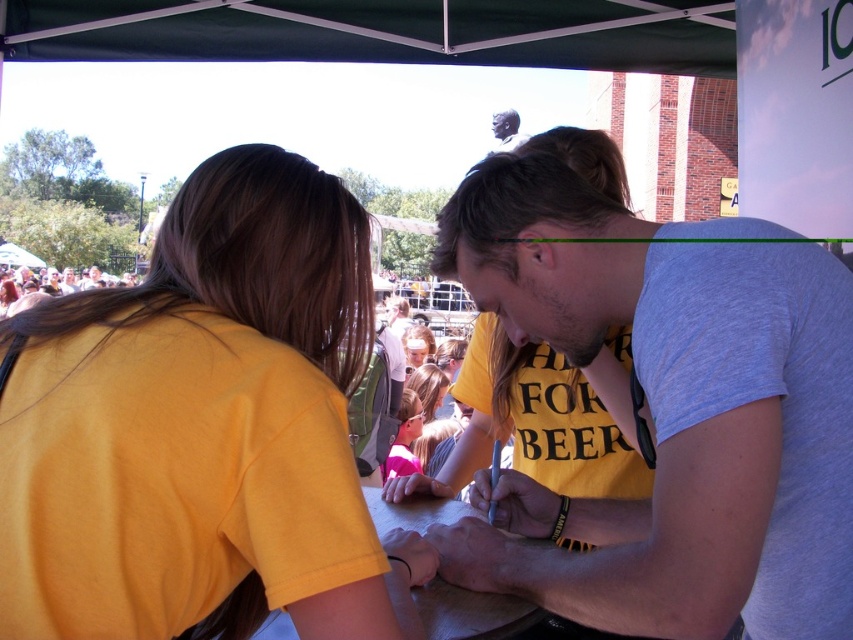
Question: Can you confirm if gray cotton shirt at center is positioned below yellow matte t-shirt at center?

Choices:
 (A) yes
 (B) no

Answer: (B)

Question: Among these points, which one is farthest from the camera?

Choices:
 (A) (206, 1)
 (B) (508, 148)
 (C) (549, 456)

Answer: (B)

Question: Which point is farther from the camera taking this photo?

Choices:
 (A) 340,32
 (B) 529,417

Answer: (A)

Question: Does gray cotton shirt at center lie behind matte pink shirt at center?

Choices:
 (A) yes
 (B) no

Answer: (B)

Question: Which of these objects is positioned farthest from the matte pink shirt at center?

Choices:
 (A) gray cotton shirt at center
 (B) yellow matte t-shirt at center

Answer: (A)

Question: Can you confirm if gray cotton shirt at center is positioned to the left of matte black face at upper center?

Choices:
 (A) no
 (B) yes

Answer: (B)